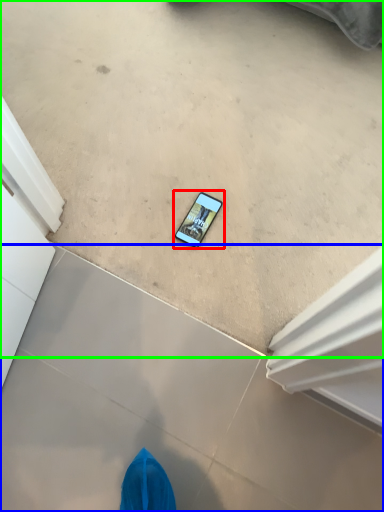
Question: Considering the real-world distances, which object is farthest from mobile phone (highlighted by a red box)? concrete (highlighted by a blue box) or concrete (highlighted by a green box)?

Choices:
 (A) concrete
 (B) concrete

Answer: (A)